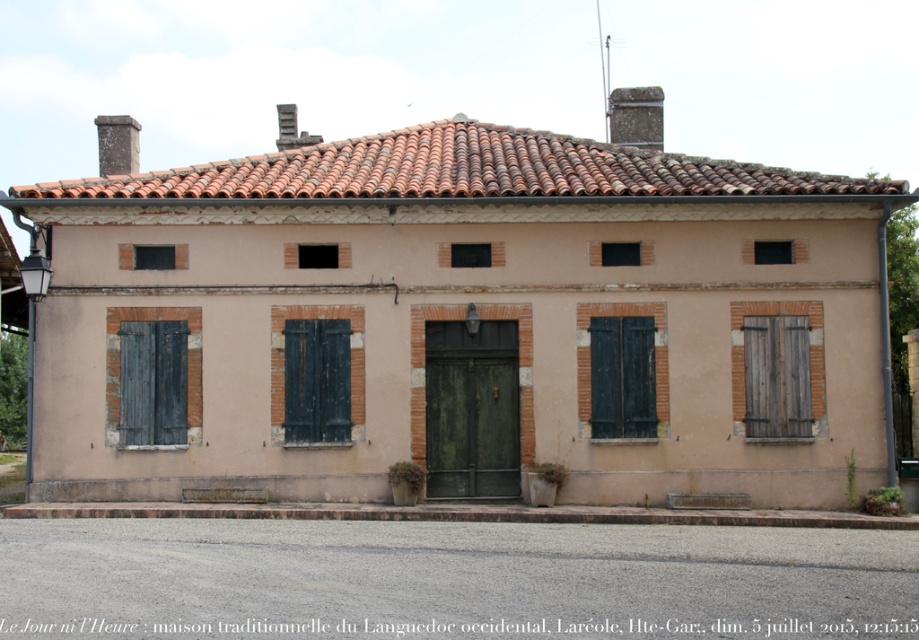
Does wooden at right have a greater height compared to brown wooden shutter at center?

No.

Is wooden at right to the right of brown wooden shutter at center from the viewer's perspective?

Yes, wooden at right is to the right of brown wooden shutter at center.

Describe the element at coordinates (776, 376) in the screenshot. The width and height of the screenshot is (919, 640). I see `wooden at right` at that location.

Where is `wooden at right`? The height and width of the screenshot is (640, 919). wooden at right is located at coordinates (776, 376).

Does dark gray wood shutter at left have a greater height compared to brown wooden shutter at center?

Yes, dark gray wood shutter at left is taller than brown wooden shutter at center.

You are a GUI agent. You are given a task and a screenshot of the screen. Output one action in this format:
    pyautogui.click(x=<x>, y=<y>)
    Task: Click on the dark gray wood shutter at left
    This screenshot has height=640, width=919.
    Given the screenshot: What is the action you would take?
    pyautogui.click(x=153, y=381)

Is point (135, 369) closer to viewer compared to point (787, 378)?

That is True.

Does point (167, 381) lie behind point (749, 410)?

No.

Between point (129, 353) and point (751, 433), which one is positioned in front?

Point (129, 353) is more forward.

Identify the location of dark gray wood shutter at left. (153, 381).